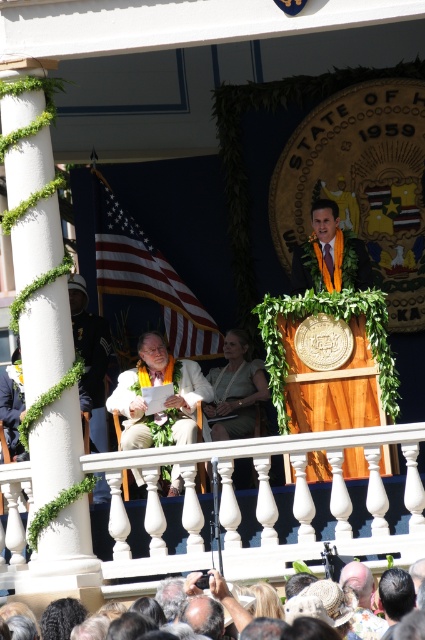
Question: Which of the following is the farthest from the observer?

Choices:
 (A) (340, 632)
 (B) (124, 388)
 (C) (129, 289)

Answer: (C)

Question: Which object is positioned closest to the light brown leather jacket at center?

Choices:
 (A) gray hair at lower center
 (B) matte orange lei at center

Answer: (B)

Question: Is american flag at left smaller than light brown leather jacket at center?

Choices:
 (A) yes
 (B) no

Answer: (A)

Question: Does american flag at left appear over light brown leather jacket at center?

Choices:
 (A) no
 (B) yes

Answer: (B)

Question: Is light brown leather jacket at center positioned behind matte orange lei at center?

Choices:
 (A) yes
 (B) no

Answer: (B)

Question: Which point appears farthest from the camera in this image?

Choices:
 (A) (320, 236)
 (B) (16, 602)

Answer: (A)